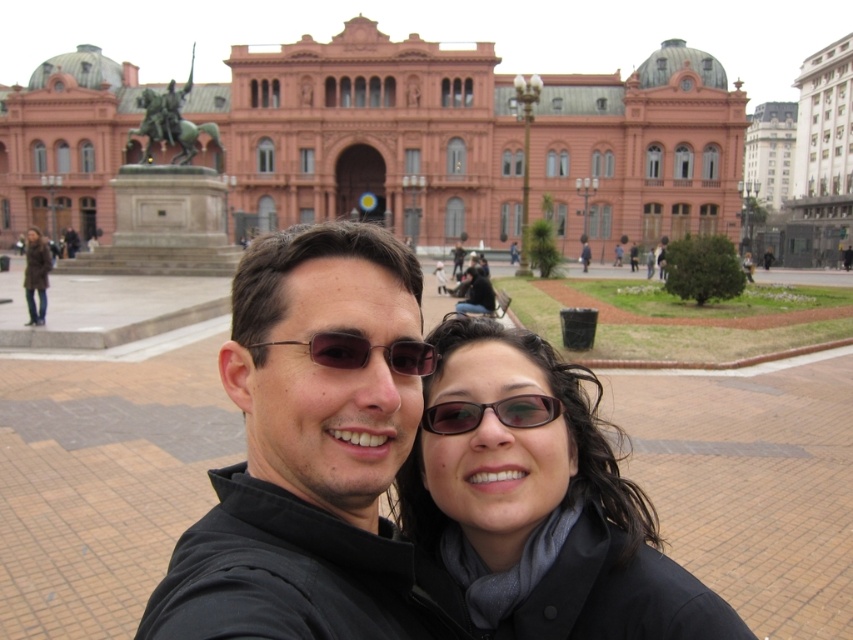
Question: Can you confirm if black matte jacket at center is thinner than brown leather jacket at upper left?

Choices:
 (A) yes
 (B) no

Answer: (B)

Question: Among these objects, which one is nearest to the camera?

Choices:
 (A) black matte jacket at center
 (B) pink stone building at center
 (C) matte black sunglasses at center

Answer: (A)

Question: Is pink stone building at center below brown leather jacket at upper left?

Choices:
 (A) yes
 (B) no

Answer: (B)

Question: Among these objects, which one is nearest to the camera?

Choices:
 (A) sunglasses at center
 (B) matte black sunglasses at center

Answer: (A)

Question: Estimate the real-world distances between objects in this image. Which object is closer to the black matte jacket at center?

Choices:
 (A) sunglasses at center
 (B) matte black sunglasses at center
 (C) black matte sunglasses at center

Answer: (C)

Question: Does black matte sunglasses at center appear over black matte jacket at center?

Choices:
 (A) no
 (B) yes

Answer: (B)